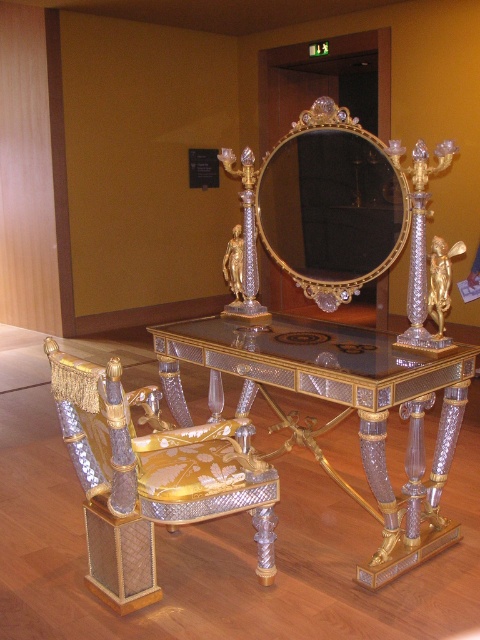
In order to click on gold crystal chair at center in this screenshot , I will do `click(149, 477)`.

Between gold crystal chair at center and gold/gilded mirror at center, which one appears on the left side from the viewer's perspective?

From the viewer's perspective, gold crystal chair at center appears more on the left side.

Describe the element at coordinates (149, 477) in the screenshot. I see `gold crystal chair at center` at that location.

Locate an element on the screen. gold crystal chair at center is located at coordinates (149, 477).

Is gold/glass vanity at center thinner than gold crystal chair at center?

In fact, gold/glass vanity at center might be wider than gold crystal chair at center.

Who is positioned more to the left, gold/glass vanity at center or gold crystal chair at center?

From the viewer's perspective, gold crystal chair at center appears more on the left side.

Locate an element on the screen. This screenshot has width=480, height=640. gold/glass vanity at center is located at coordinates (340, 412).

The image size is (480, 640). In order to click on gold/glass vanity at center in this screenshot , I will do `click(340, 412)`.

Is gold/glass vanity at center above gold/gilded mirror at center?

No.

Describe the element at coordinates (340, 412) in the screenshot. The image size is (480, 640). I see `gold/glass vanity at center` at that location.

Is point (256, 326) positioned before point (408, 212)?

No, it is behind (408, 212).

The image size is (480, 640). I want to click on gold/glass vanity at center, so click(x=340, y=412).